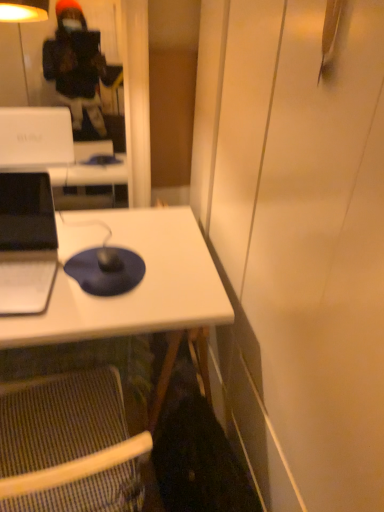
I want to click on free space to the right of blue matte mousepad at center, so click(x=175, y=274).